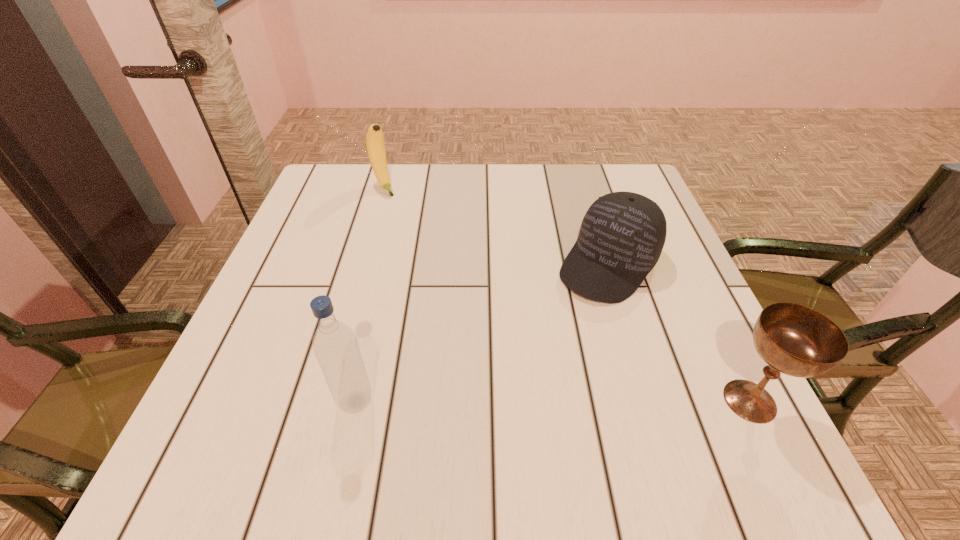
You are a GUI agent. You are given a task and a screenshot of the screen. Output one action in this format:
    pyautogui.click(x=<x>, y=<y>)
    Task: Click on the free spot that satisfies the following two spatial constraints: 1. on the back side of the chalice; 2. on the right side of the tallest object
    
    Given the screenshot: What is the action you would take?
    pyautogui.click(x=356, y=401)